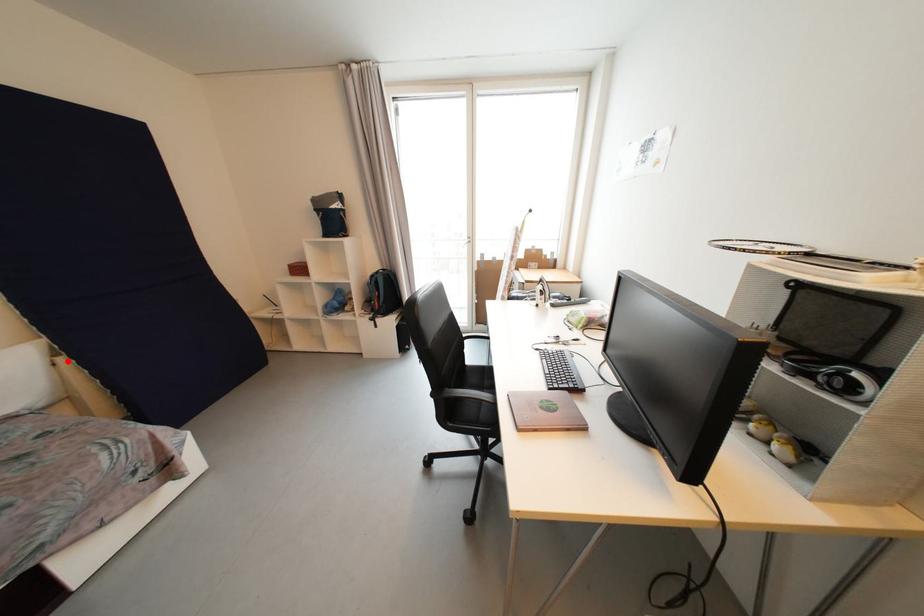
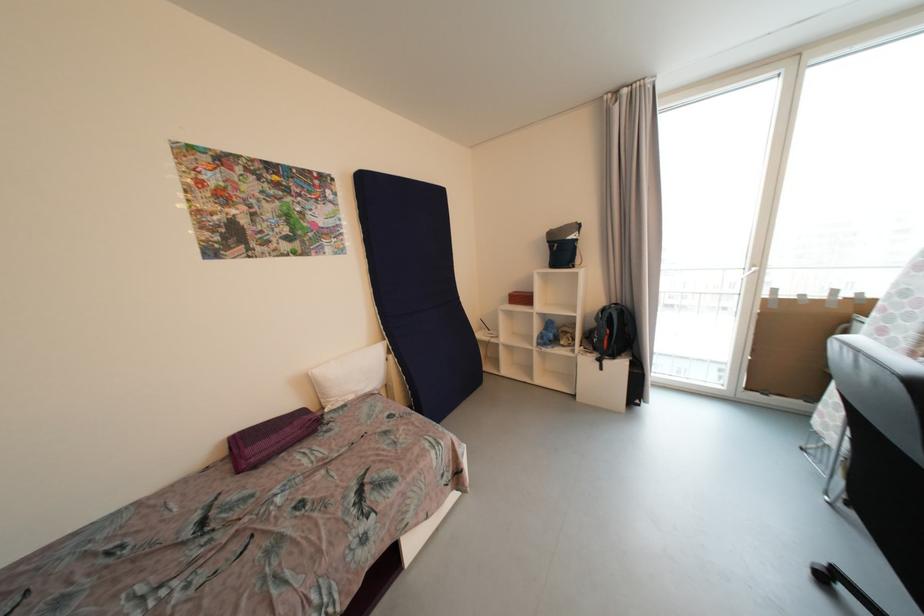
Question: A red point is marked in image1. In image2, is the corresponding 3D point closer to the camera or farther? Reply with the corresponding letter.

Choices:
 (A) The corresponding 3D point is closer.
 (B) The corresponding 3D point is farther.

Answer: (B)